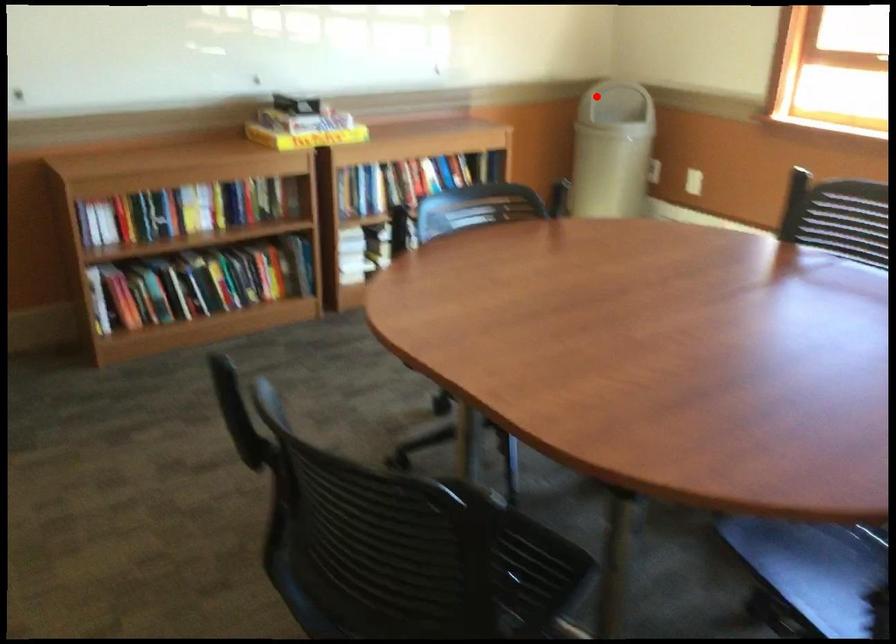
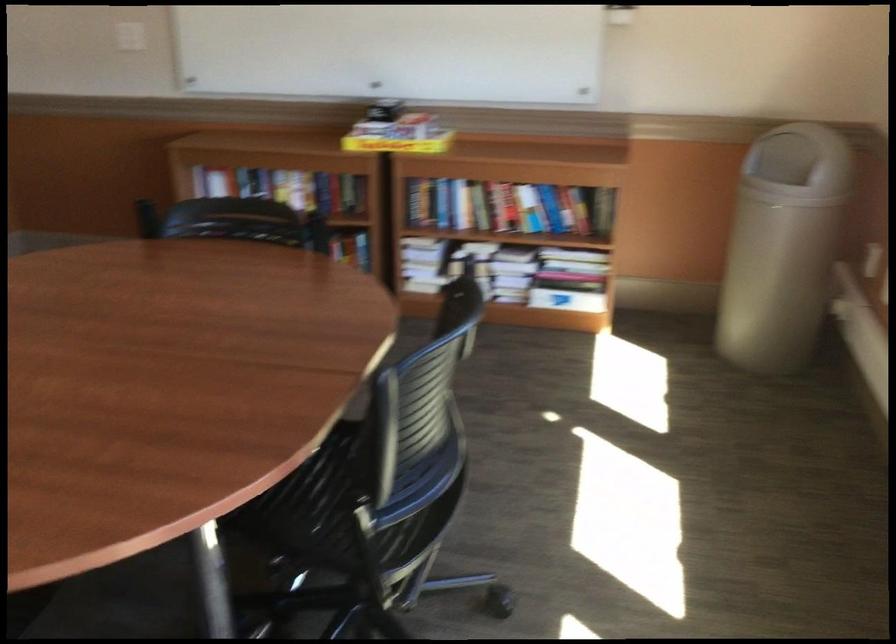
The point at the highlighted location is marked in the first image. Where is the corresponding point in the second image?

(798, 156)